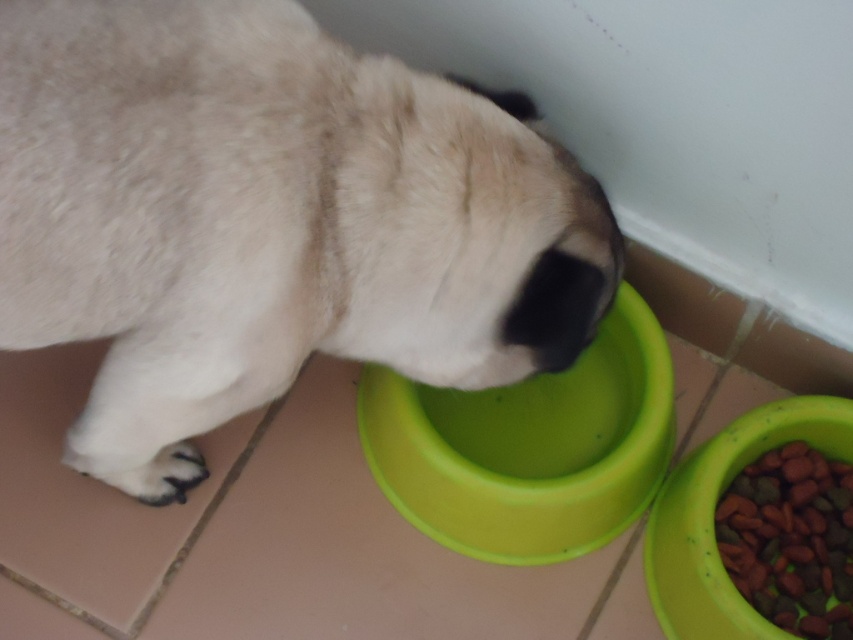
Question: Which point appears farthest from the camera in this image?

Choices:
 (A) (846, 593)
 (B) (561, 387)
 (C) (86, 32)

Answer: (B)

Question: Which of the following is the farthest from the observer?

Choices:
 (A) (241, 289)
 (B) (778, 625)

Answer: (B)

Question: Can you confirm if white fur dog at center is thinner than brown crunchy kibble at lower right?

Choices:
 (A) no
 (B) yes

Answer: (A)

Question: Is white fur dog at center behind green plastic bowl at center?

Choices:
 (A) no
 (B) yes

Answer: (A)

Question: Which of the following is the closest to the observer?

Choices:
 (A) brown crunchy kibble at lower right
 (B) green plastic bowl at center

Answer: (B)

Question: Is green plastic bowl at center below brown crunchy kibble at lower right?

Choices:
 (A) yes
 (B) no

Answer: (B)